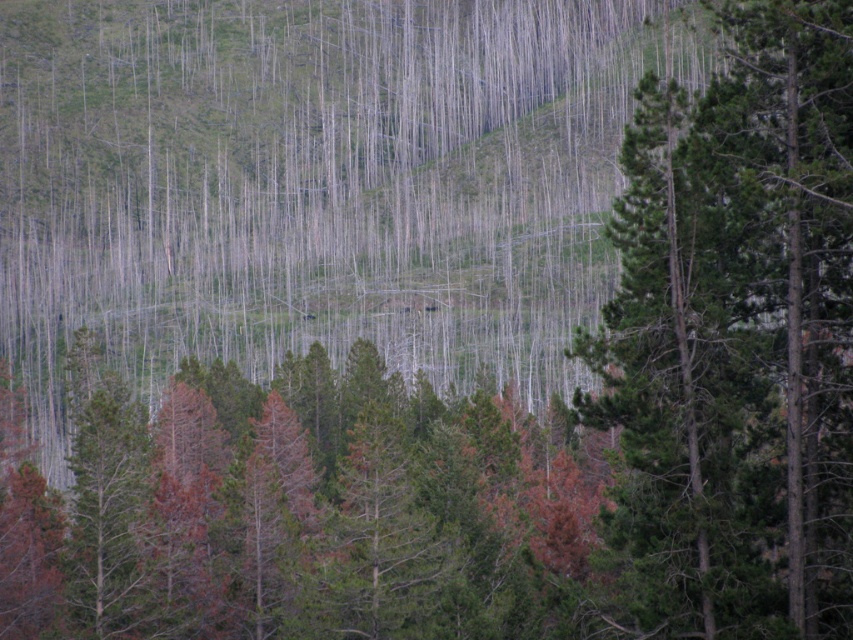
Question: Among these points, which one is farthest from the camera?

Choices:
 (A) (3, 472)
 (B) (706, 556)

Answer: (A)

Question: From the image, what is the correct spatial relationship of green matte tree at center in relation to green textured tree at center?

Choices:
 (A) below
 (B) above

Answer: (A)

Question: Is green matte tree at center to the right of green textured tree at center from the viewer's perspective?

Choices:
 (A) yes
 (B) no

Answer: (B)

Question: Can you confirm if green matte tree at center is thinner than green textured tree at center?

Choices:
 (A) no
 (B) yes

Answer: (A)